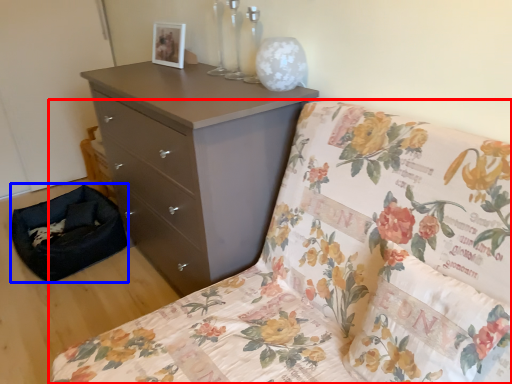
Question: Which point is further to the camera, furniture (highlighted by a red box) or footrest (highlighted by a blue box)?

Choices:
 (A) furniture
 (B) footrest

Answer: (B)